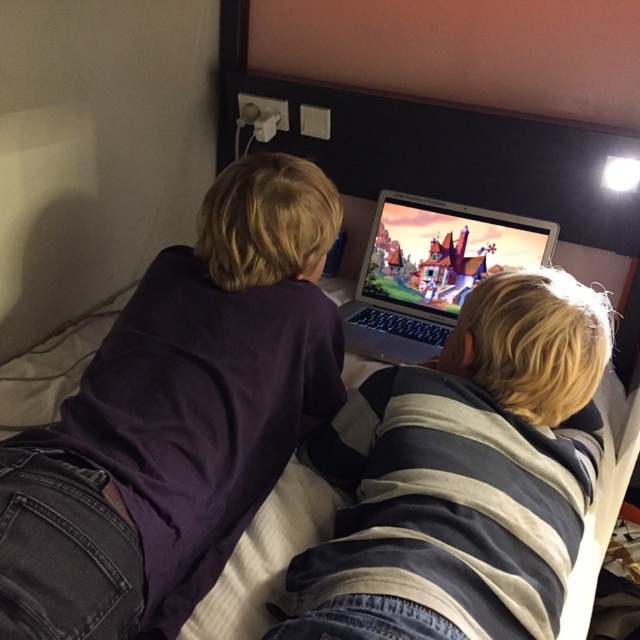
Is purple matte shirt at upper left thinner than striped hoodie at center?

Yes, purple matte shirt at upper left is thinner than striped hoodie at center.

Who is lower down, purple matte shirt at upper left or striped hoodie at center?

Positioned lower is striped hoodie at center.

Is point (225, 304) positioned before point (368, 468)?

No, (225, 304) is behind (368, 468).

Locate an element on the screen. This screenshot has width=640, height=640. purple matte shirt at upper left is located at coordinates click(x=177, y=417).

From the picture: Between purple matte shirt at upper left and satin silver laptop at upper center, which one has less height?

satin silver laptop at upper center

Looking at this image, is purple matte shirt at upper left below satin silver laptop at upper center?

Correct, purple matte shirt at upper left is located below satin silver laptop at upper center.

Between point (161, 275) and point (481, 228), which one is positioned in front?

Positioned in front is point (161, 275).

Locate an element on the screen. purple matte shirt at upper left is located at coordinates (177, 417).

Does striped hoodie at center have a greater height compared to satin silver laptop at upper center?

Correct, striped hoodie at center is much taller as satin silver laptop at upper center.

Is point (364, 563) positioned behind point (362, 328)?

No.

Between point (420, 596) and point (372, 244), which one is positioned in front?

Point (420, 596) is more forward.

Locate an element on the screen. striped hoodie at center is located at coordinates (461, 476).